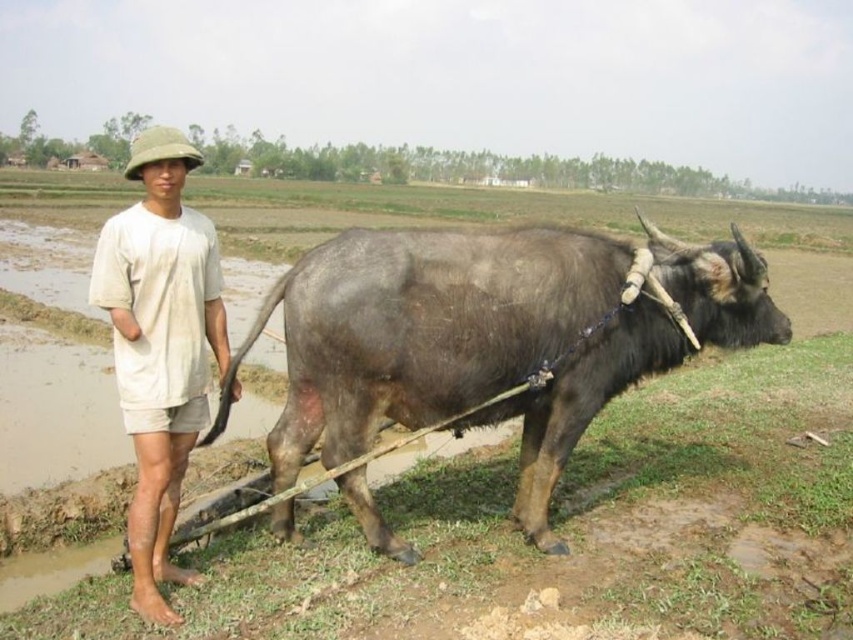
You are standing at the point marked at (578,387). The man and the water buffalo are both in your view. How far apart are they from each other?

The man and the water buffalo are 4.38 meters apart.

You are a farmer who wants to ensure the dark gray textured bull at right can pass under a low tree branch that is at the same height as the light beige cotton shirt at left. Can the bull pass under the branch without bending?

The dark gray textured bull at right is not as tall as the light beige cotton shirt at left, so the bull can pass under the branch at the same height as the light beige cotton shirt at left without bending.

You are a farmer standing at the camera position. You need to attach a harness to the dark gray textured bull at right. Can you reach the bull from your current position without moving closer?

The distance between the dark gray textured bull at right and the camera is 3.88 meters. Since the farmer is at the camera position, they would need to move closer to reach the bull, as 3.88 meters is too far to attach the harness without moving.